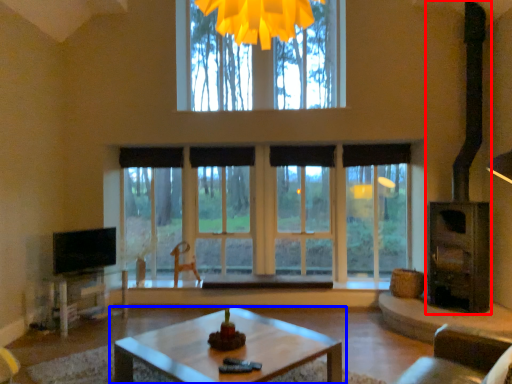
Question: Among these objects, which one is farthest to the camera, fireplace (highlighted by a red box) or coffee table (highlighted by a blue box)?

Choices:
 (A) fireplace
 (B) coffee table

Answer: (A)